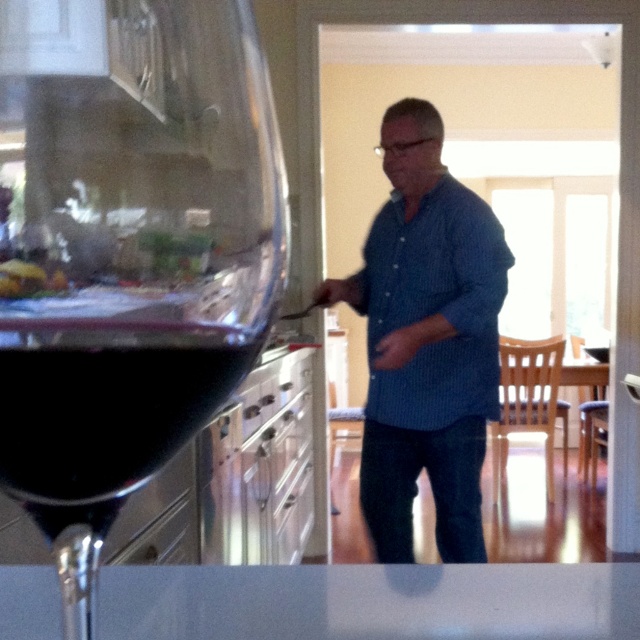
Question: Can you confirm if dark glass at left is positioned above dark red liquid at left?

Choices:
 (A) yes
 (B) no

Answer: (A)

Question: Which of the following is the farthest from the observer?

Choices:
 (A) (436, 157)
 (B) (100, 362)

Answer: (A)

Question: Can you confirm if dark glass at left is positioned above blue striped shirt at center?

Choices:
 (A) no
 (B) yes

Answer: (B)

Question: Which point appears farthest from the camera in this image?

Choices:
 (A) (42, 433)
 (B) (419, 204)

Answer: (B)

Question: Which object is the farthest from the blue striped shirt at center?

Choices:
 (A) dark glass at left
 (B) dark red liquid at left

Answer: (B)

Question: Does dark glass at left lie behind blue striped shirt at center?

Choices:
 (A) yes
 (B) no

Answer: (B)